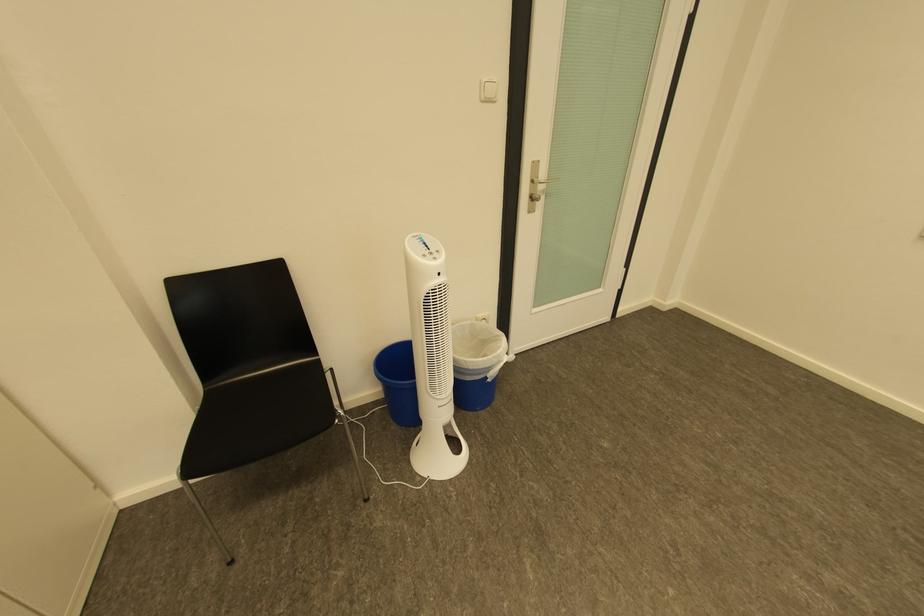
The image size is (924, 616). I want to click on blue bucket, so click(x=398, y=382).